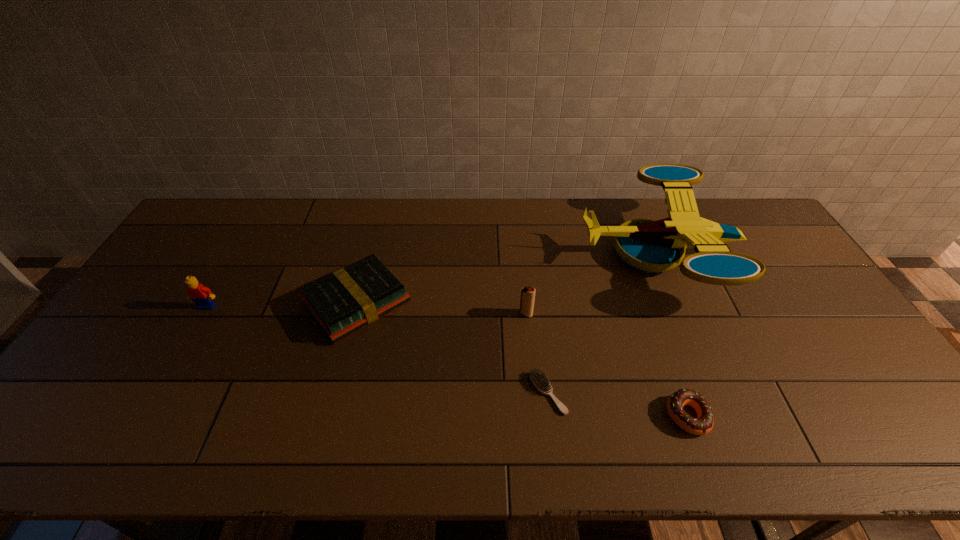
Image resolution: width=960 pixels, height=540 pixels. I want to click on the tallest object, so click(x=652, y=246).

This screenshot has height=540, width=960. I want to click on Lego, so [201, 295].

The height and width of the screenshot is (540, 960). Identify the location of igniter. (527, 299).

Locate an element on the screen. hardback book is located at coordinates (345, 301).

You are a GUI agent. You are given a task and a screenshot of the screen. Output one action in this format:
    pyautogui.click(x=<x>, y=<y>)
    Task: Click on the fourth tallest object
    This screenshot has width=960, height=540.
    Given the screenshot: What is the action you would take?
    pyautogui.click(x=345, y=301)

Identify the location of the fifth tallest object. (703, 424).

Find the location of `the shortest object`. the shortest object is located at coordinates (540, 380).

Image resolution: width=960 pixels, height=540 pixels. Find the location of `vacant space located 0.130m at the cockpit of the tallest object`. vacant space located 0.130m at the cockpit of the tallest object is located at coordinates (541, 252).

Where is `vacant space situated at the cockpit of the tallest object`? vacant space situated at the cockpit of the tallest object is located at coordinates (502, 252).

Locate an element on the screen. vacant space located at the cockpit of the tallest object is located at coordinates (467, 252).